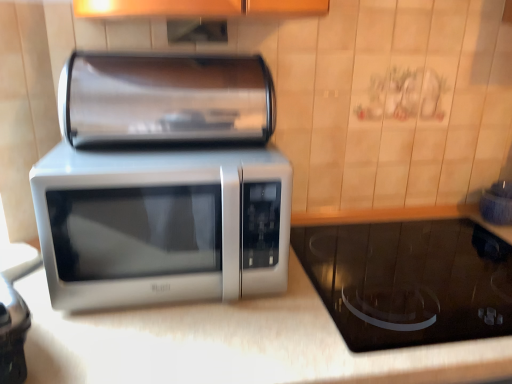
Question: Is black glass cooktop at lower right, the first appliance from the bottom, behind satin silver microwave at center?

Choices:
 (A) no
 (B) yes

Answer: (B)

Question: Could you tell me if black glass cooktop at lower right, placed as the second appliance when sorted from top to bottom, is turned towards satin silver microwave at center?

Choices:
 (A) yes
 (B) no

Answer: (B)

Question: Is black glass cooktop at lower right, the first appliance from the bottom, closer to the viewer compared to satin silver microwave at center?

Choices:
 (A) yes
 (B) no

Answer: (B)

Question: Can you confirm if black glass cooktop at lower right, the first appliance from the bottom, is positioned to the right of satin silver microwave at center?

Choices:
 (A) no
 (B) yes

Answer: (B)

Question: Is black glass cooktop at lower right, which is counted as the second appliance, starting from the left, shorter than satin silver microwave at center?

Choices:
 (A) yes
 (B) no

Answer: (A)

Question: From the image's perspective, relative to black glass cooktop at lower right, which is the 1th appliance in right-to-left order, is satin silver paper towel holder at upper center, placed as the second appliance when sorted from right to left, above or below?

Choices:
 (A) above
 (B) below

Answer: (A)

Question: Is point (126, 120) positioned closer to the camera than point (380, 261)?

Choices:
 (A) closer
 (B) farther

Answer: (A)

Question: Is satin silver paper towel holder at upper center, the 2th appliance when ordered from bottom to top, wider or thinner than black glass cooktop at lower right, which is the 1th appliance in right-to-left order?

Choices:
 (A) wide
 (B) thin

Answer: (B)

Question: Based on their sizes in the image, would you say satin silver paper towel holder at upper center, positioned as the first appliance in left-to-right order, is bigger or smaller than black glass cooktop at lower right, which is the 1th appliance in right-to-left order?

Choices:
 (A) big
 (B) small

Answer: (B)

Question: From a real-world perspective, relative to black glass cooktop at lower right, the first appliance from the bottom, is satin silver microwave at center vertically above or below?

Choices:
 (A) below
 (B) above

Answer: (B)

Question: Visually, is satin silver microwave at center positioned to the left or to the right of black glass cooktop at lower right, which is the 1th appliance in right-to-left order?

Choices:
 (A) left
 (B) right

Answer: (A)

Question: Is satin silver microwave at center in front of or behind black glass cooktop at lower right, the first appliance from the bottom, in the image?

Choices:
 (A) front
 (B) behind

Answer: (A)

Question: Is satin silver microwave at center taller or shorter than black glass cooktop at lower right, which is the 1th appliance in right-to-left order?

Choices:
 (A) tall
 (B) short

Answer: (A)

Question: In terms of height, does black glass cooktop at lower right, which is counted as the second appliance, starting from the left, look taller or shorter compared to satin silver paper towel holder at upper center, the 2th appliance when ordered from bottom to top?

Choices:
 (A) tall
 (B) short

Answer: (B)

Question: From a real-world perspective, relative to satin silver paper towel holder at upper center, placed as the second appliance when sorted from right to left, is black glass cooktop at lower right, the first appliance from the bottom, vertically above or below?

Choices:
 (A) above
 (B) below

Answer: (B)